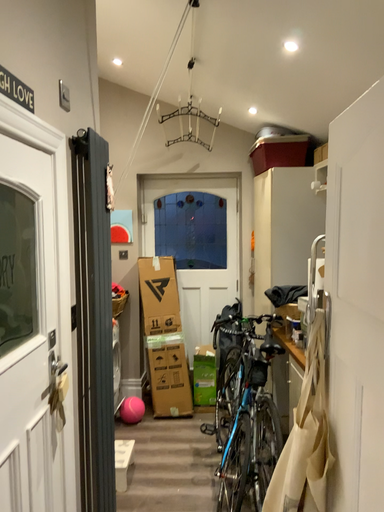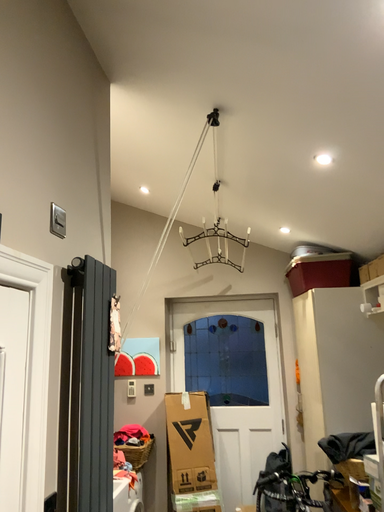
Question: How did the camera likely rotate when shooting the video?

Choices:
 (A) rotated upward
 (B) rotated downward

Answer: (A)